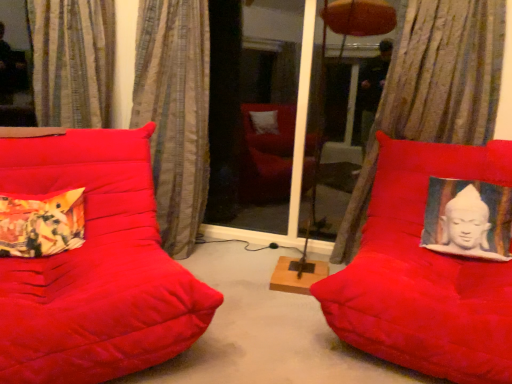
The width and height of the screenshot is (512, 384). Identify the location of textured beige curtain at left, which is the 2th curtain in left-to-right order. (175, 113).

Describe the element at coordinates (434, 90) in the screenshot. This screenshot has width=512, height=384. I see `textured beige curtain at upper right, positioned as the 3th curtain in left-to-right order` at that location.

Locate an element on the screen. This screenshot has width=512, height=384. textured beige curtain at upper right, positioned as the 3th curtain in left-to-right order is located at coordinates (434, 90).

The height and width of the screenshot is (384, 512). What do you see at coordinates (88, 261) in the screenshot? I see `matte red cushion at left, which appears as the 1th furniture when viewed from the left` at bounding box center [88, 261].

What is the approximate width of matte red cushion at left, which is the 2th furniture from right to left?

matte red cushion at left, which is the 2th furniture from right to left, is 3.30 feet in width.

At what (x,y) coordinates should I click in order to perform the action: click on suede red cushion at right, the first furniture viewed from the right. Please return your answer as a coordinate pair (x, y). This screenshot has width=512, height=384. Looking at the image, I should click on (424, 273).

The height and width of the screenshot is (384, 512). What do you see at coordinates (274, 116) in the screenshot?
I see `transparent glass screen door at center` at bounding box center [274, 116].

Find the location of a particular element. This screenshot has height=384, width=512. floral fabric cushion at left is located at coordinates point(41,223).

Is striped fabric curtain at upper left, arranged as the 3th curtain when viewed from the right, looking in the opposite direction of matte red cushion at left, which is the 2th furniture from right to left?

No, striped fabric curtain at upper left, arranged as the 3th curtain when viewed from the right, is not facing away from matte red cushion at left, which is the 2th furniture from right to left.

Is matte red cushion at left, which appears as the 1th furniture when viewed from the left, completely or partially inside striped fabric curtain at upper left, arranged as the 3th curtain when viewed from the right?

No, matte red cushion at left, which appears as the 1th furniture when viewed from the left, is located outside of striped fabric curtain at upper left, arranged as the 3th curtain when viewed from the right.

What's the angular difference between striped fabric curtain at upper left, arranged as the 3th curtain when viewed from the right, and matte red cushion at left, which appears as the 1th furniture when viewed from the left,'s facing directions?

The angular difference between striped fabric curtain at upper left, arranged as the 3th curtain when viewed from the right, and matte red cushion at left, which appears as the 1th furniture when viewed from the left, is 6.08 degrees.

Which of these two, striped fabric curtain at upper left, the 1th curtain positioned from the left, or matte red cushion at left, which appears as the 1th furniture when viewed from the left, stands taller?

With more height is matte red cushion at left, which appears as the 1th furniture when viewed from the left.

Between suede red cushion at right, the first furniture viewed from the right, and striped fabric curtain at upper left, arranged as the 3th curtain when viewed from the right, which one has smaller width?

With smaller width is striped fabric curtain at upper left, arranged as the 3th curtain when viewed from the right.

Measure the distance from suede red cushion at right, positioned as the 2th furniture in left-to-right order, to striped fabric curtain at upper left, the 1th curtain positioned from the left.

suede red cushion at right, positioned as the 2th furniture in left-to-right order, and striped fabric curtain at upper left, the 1th curtain positioned from the left, are 6.13 feet apart.

From the image's perspective, count 2nd furnitures downward from the striped fabric curtain at upper left, the 1th curtain positioned from the left, and point to it. Please provide its 2D coordinates.

[(424, 273)]

Who is shorter, suede red cushion at right, the first furniture viewed from the right, or striped fabric curtain at upper left, arranged as the 3th curtain when viewed from the right?

striped fabric curtain at upper left, arranged as the 3th curtain when viewed from the right.

Is transparent glass screen door at center spatially inside matte red cushion at left, which appears as the 1th furniture when viewed from the left, or outside of it?

transparent glass screen door at center cannot be found inside matte red cushion at left, which appears as the 1th furniture when viewed from the left.

How far apart are transparent glass screen door at center and matte red cushion at left, which is the 2th furniture from right to left?

transparent glass screen door at center is 1.41 meters away from matte red cushion at left, which is the 2th furniture from right to left.

Considering the sizes of objects transparent glass screen door at center and matte red cushion at left, which appears as the 1th furniture when viewed from the left, in the image provided, who is smaller, transparent glass screen door at center or matte red cushion at left, which appears as the 1th furniture when viewed from the left,?

Smaller between the two is transparent glass screen door at center.

Are floral fabric cushion at left and striped fabric curtain at upper left, arranged as the 3th curtain when viewed from the right, located far from each other?

floral fabric cushion at left is actually quite close to striped fabric curtain at upper left, arranged as the 3th curtain when viewed from the right.

Is floral fabric cushion at left turned away from striped fabric curtain at upper left, arranged as the 3th curtain when viewed from the right?

No, floral fabric cushion at left is not facing away from striped fabric curtain at upper left, arranged as the 3th curtain when viewed from the right.

Can we say matte red cushion at left, which appears as the 1th furniture when viewed from the left, lies outside striped fabric curtain at upper left, the 1th curtain positioned from the left?

matte red cushion at left, which appears as the 1th furniture when viewed from the left, is positioned outside striped fabric curtain at upper left, the 1th curtain positioned from the left.

Considering the positions of point (126, 191) and point (48, 113), is point (126, 191) closer or farther from the camera than point (48, 113)?

Point (126, 191) is closer to the camera than point (48, 113).

From a real-world perspective, is matte red cushion at left, which appears as the 1th furniture when viewed from the left, under striped fabric curtain at upper left, the 1th curtain positioned from the left?

Yes, from a real-world perspective, matte red cushion at left, which appears as the 1th furniture when viewed from the left, is under striped fabric curtain at upper left, the 1th curtain positioned from the left.

There is a striped fabric curtain at upper left, the 1th curtain positioned from the left. Where is `the 2nd furniture below it (from a real-world perspective)`? the 2nd furniture below it (from a real-world perspective) is located at coordinates (88, 261).

From a real-world perspective, which object stands above the other?

transparent glass screen door at center, from a real-world perspective.

Does floral fabric cushion at left have a lesser width compared to transparent glass screen door at center?

No, floral fabric cushion at left is not thinner than transparent glass screen door at center.

Image resolution: width=512 pixels, height=384 pixels. In order to click on screen door located above the floral fabric cushion at left (from the image's perspective) in this screenshot , I will do `click(274, 116)`.

Could transparent glass screen door at center be considered to be inside floral fabric cushion at left?

That's incorrect, transparent glass screen door at center is not inside floral fabric cushion at left.

Is floral fabric cushion at left placed right next to textured beige curtain at left, which is the 2th curtain in left-to-right order?

There is a gap between floral fabric cushion at left and textured beige curtain at left, which is the 2th curtain in left-to-right order.

Based on their sizes in the image, would you say floral fabric cushion at left is bigger or smaller than textured beige curtain at left, which is counted as the second curtain, starting from the right?

Considering their sizes, floral fabric cushion at left takes up less space than textured beige curtain at left, which is counted as the second curtain, starting from the right.

Considering the sizes of objects floral fabric cushion at left and textured beige curtain at left, which is counted as the second curtain, starting from the right, in the image provided, who is thinner, floral fabric cushion at left or textured beige curtain at left, which is counted as the second curtain, starting from the right,?

floral fabric cushion at left.

There is a matte red cushion at left, which is the 2th furniture from right to left. Where is `the 3rd curtain above it (from a real-world perspective)`? Image resolution: width=512 pixels, height=384 pixels. the 3rd curtain above it (from a real-world perspective) is located at coordinates (72, 61).

Starting from the striped fabric curtain at upper left, the 1th curtain positioned from the left, which furniture is the 1st one in front? Please provide its 2D coordinates.

[(424, 273)]

Which object lies further to the anchor point suede red cushion at right, the first furniture viewed from the right, textured beige curtain at upper right, which is the 1th curtain in right-to-left order, or matte red cushion at left, which appears as the 1th furniture when viewed from the left?

The object further to suede red cushion at right, the first furniture viewed from the right, is matte red cushion at left, which appears as the 1th furniture when viewed from the left.

Estimate the real-world distances between objects in this image. Which object is closer to floral fabric cushion at left, transparent glass screen door at center or textured beige curtain at upper right, positioned as the 3th curtain in left-to-right order?

transparent glass screen door at center.

Which object lies nearer to the anchor point textured beige curtain at upper right, positioned as the 3th curtain in left-to-right order, textured beige curtain at left, which is counted as the second curtain, starting from the right, or suede red cushion at right, positioned as the 2th furniture in left-to-right order?

suede red cushion at right, positioned as the 2th furniture in left-to-right order, is positioned closer to the anchor textured beige curtain at upper right, positioned as the 3th curtain in left-to-right order.

When comparing their distances from matte red cushion at left, which is the 2th furniture from right to left, does suede red cushion at right, the first furniture viewed from the right, or textured beige curtain at upper right, positioned as the 3th curtain in left-to-right order, seem closer?

suede red cushion at right, the first furniture viewed from the right, lies closer to matte red cushion at left, which is the 2th furniture from right to left, than the other object.

Which object lies nearer to the anchor point textured beige curtain at upper right, positioned as the 3th curtain in left-to-right order, striped fabric curtain at upper left, arranged as the 3th curtain when viewed from the right, or matte red cushion at left, which appears as the 1th furniture when viewed from the left?

matte red cushion at left, which appears as the 1th furniture when viewed from the left, lies closer to textured beige curtain at upper right, positioned as the 3th curtain in left-to-right order, than the other object.

Considering their positions, is striped fabric curtain at upper left, the 1th curtain positioned from the left, positioned further to transparent glass screen door at center than matte red cushion at left, which is the 2th furniture from right to left?

matte red cushion at left, which is the 2th furniture from right to left, lies further to transparent glass screen door at center than the other object.

When comparing their distances from textured beige curtain at upper right, positioned as the 3th curtain in left-to-right order, does suede red cushion at right, positioned as the 2th furniture in left-to-right order, or textured beige curtain at left, which is the 2th curtain in left-to-right order, seem further?

textured beige curtain at left, which is the 2th curtain in left-to-right order.

Looking at the image, which one is located closer to striped fabric curtain at upper left, arranged as the 3th curtain when viewed from the right, matte red cushion at left, which appears as the 1th furniture when viewed from the left, or suede red cushion at right, the first furniture viewed from the right?

matte red cushion at left, which appears as the 1th furniture when viewed from the left, lies closer to striped fabric curtain at upper left, arranged as the 3th curtain when viewed from the right, than the other object.

Where is `pillow between matte red cushion at left, which appears as the 1th furniture when viewed from the left, and textured beige curtain at left, which is counted as the second curtain, starting from the right, from front to back`? The image size is (512, 384). pillow between matte red cushion at left, which appears as the 1th furniture when viewed from the left, and textured beige curtain at left, which is counted as the second curtain, starting from the right, from front to back is located at coordinates (41, 223).

Find the location of `furniture between striped fabric curtain at upper left, the 1th curtain positioned from the left, and suede red cushion at right, the first furniture viewed from the right`. furniture between striped fabric curtain at upper left, the 1th curtain positioned from the left, and suede red cushion at right, the first furniture viewed from the right is located at coordinates (88, 261).

What are the coordinates of `screen door located between striped fabric curtain at upper left, arranged as the 3th curtain when viewed from the right, and textured beige curtain at upper right, positioned as the 3th curtain in left-to-right order, in the left-right direction` in the screenshot? It's located at (274, 116).

The width and height of the screenshot is (512, 384). I want to click on pillow between matte red cushion at left, which appears as the 1th furniture when viewed from the left, and striped fabric curtain at upper left, the 1th curtain positioned from the left, from front to back, so click(x=41, y=223).